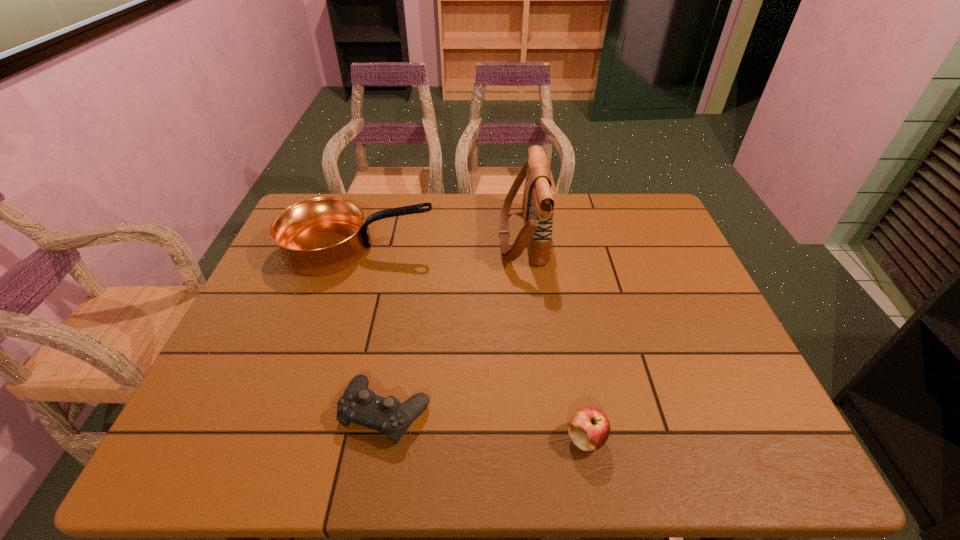
The width and height of the screenshot is (960, 540). I want to click on vacant space in between the frying pan and the apple, so click(x=472, y=343).

This screenshot has height=540, width=960. I want to click on free space that is in between the tallest object and the frying pan, so click(441, 242).

This screenshot has height=540, width=960. Identify the location of unoccupied position between the control and the frying pan. (372, 330).

The width and height of the screenshot is (960, 540). In order to click on free spot between the second tallest object and the apple in this screenshot , I will do `click(472, 343)`.

Where is `unoccupied position between the shoulder bag and the control`? Image resolution: width=960 pixels, height=540 pixels. unoccupied position between the shoulder bag and the control is located at coordinates (454, 324).

Identify the location of free space between the frying pan and the shoulder bag. This screenshot has height=540, width=960. (441, 242).

At what (x,y) coordinates should I click in order to perform the action: click on unoccupied position between the shortest object and the apple. Please return your answer as a coordinate pair (x, y). Looking at the image, I should click on (487, 425).

You are a GUI agent. You are given a task and a screenshot of the screen. Output one action in this format:
    pyautogui.click(x=<x>, y=<y>)
    Task: Click on the unoccupied position between the shortest object and the frying pan
    
    Given the screenshot: What is the action you would take?
    pyautogui.click(x=372, y=330)

Locate an element on the screen. The width and height of the screenshot is (960, 540). free spot between the apple and the shoulder bag is located at coordinates (554, 338).

Find the location of a particular element. The width and height of the screenshot is (960, 540). object that stands as the second closest to the control is located at coordinates (320, 236).